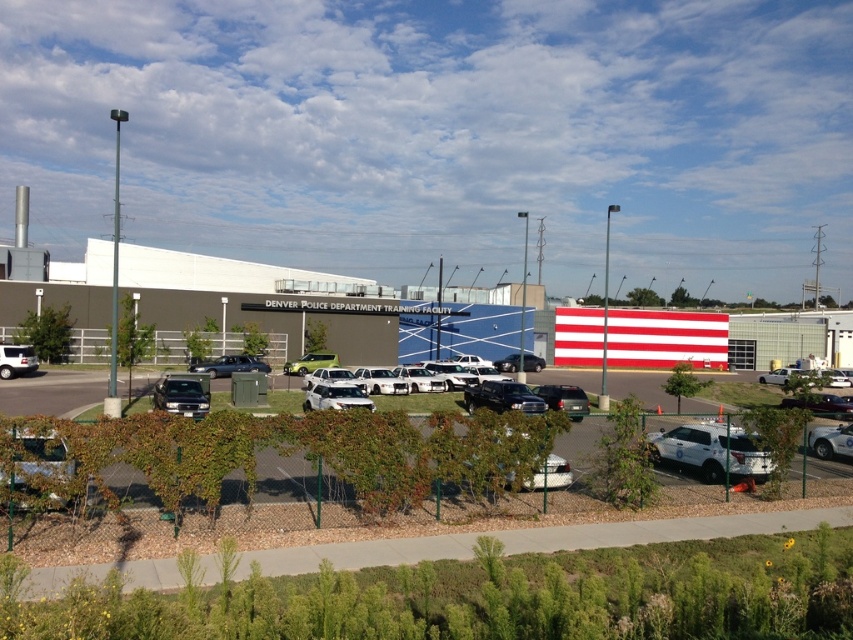
You are a visitor arriving at the Denver Police Department Training Facility and need to park your car. You see a white glossy police car at center and a white matte sedan at center. Which vehicle should you park to the left of to align with the parking lot rules?

You should park to the left of the white glossy police car at center because it is already positioned to the right of the white matte sedan at center, indicating the correct parking alignment.

You are a visitor arriving at the Denver Police Department Training Facility. You see a white glossy police car at center and a white matte sedan at center. Which vehicle is positioned higher in the image?

The white glossy police car at center is located above the white matte sedan at center, so it is positioned higher in the image.